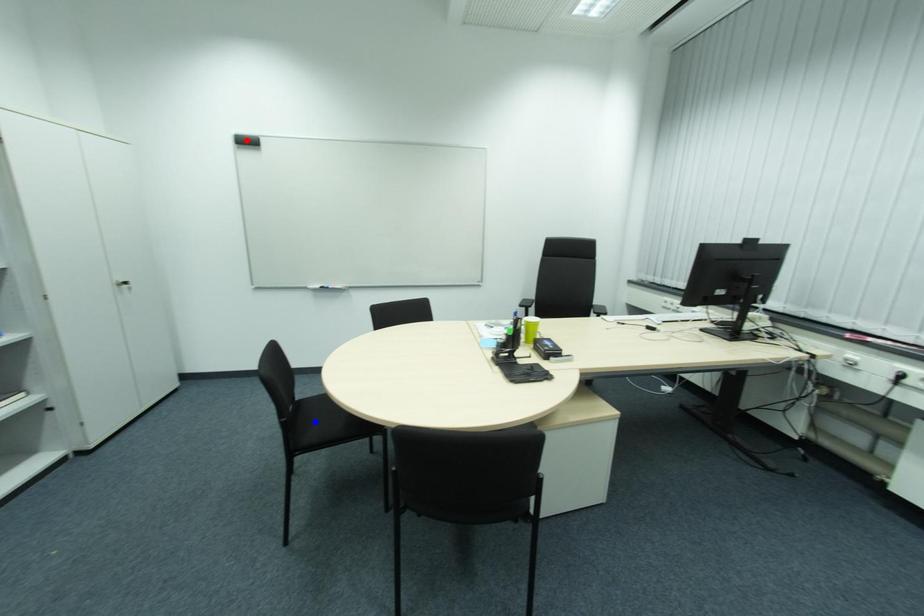
Question: Two points are marked on the image. Which point is closer to the camera?

Choices:
 (A) Blue point is closer.
 (B) Red point is closer.

Answer: (A)